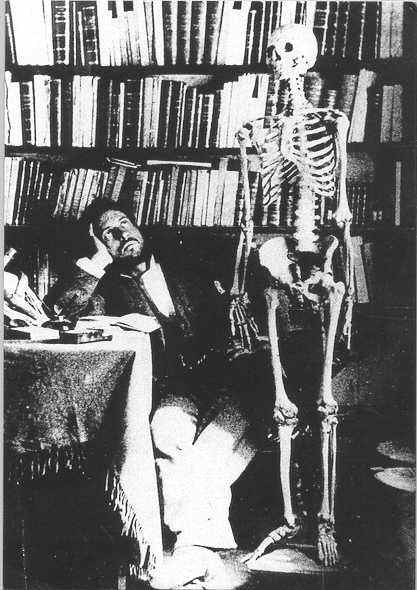
You are a GUI agent. You are given a task and a screenshot of the screen. Output one action in this format:
    pyautogui.click(x=<x>, y=<y>)
    Task: Click on the books
    The width and height of the screenshot is (417, 590).
    Given the screenshot: What is the action you would take?
    pyautogui.click(x=183, y=122), pyautogui.click(x=113, y=45)